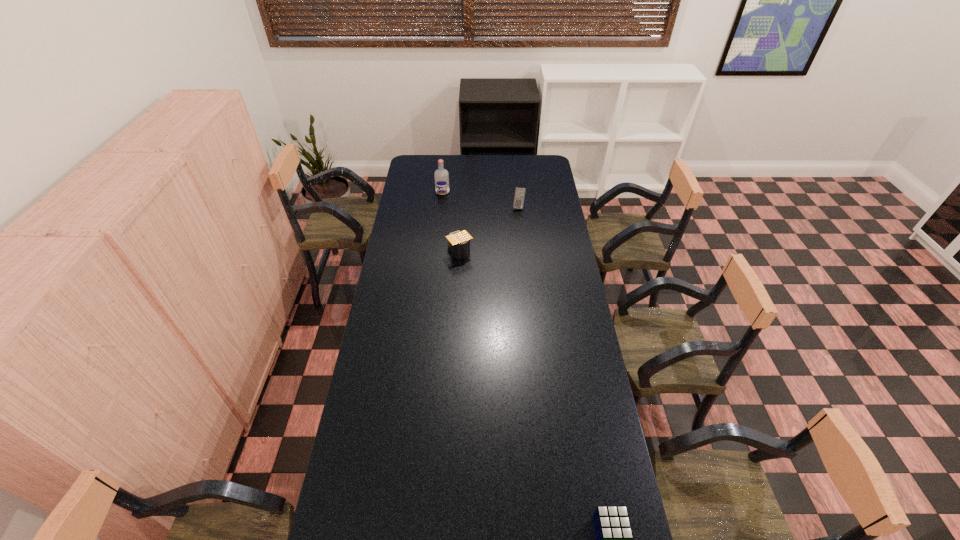
Where is `vacant space at the left edge`? Image resolution: width=960 pixels, height=540 pixels. vacant space at the left edge is located at coordinates (400, 323).

In the image, there is a desktop. At what (x,y) coordinates should I click in order to perform the action: click on vacant space at the right edge. Please return your answer as a coordinate pair (x, y). This screenshot has width=960, height=540. Looking at the image, I should click on (553, 181).

This screenshot has width=960, height=540. Identify the location of vacant space at the far left corner of the desktop. (430, 171).

Locate an element on the screen. vacant area that lies between the tallest object and the right calculator is located at coordinates (481, 199).

The width and height of the screenshot is (960, 540). In order to click on empty space between the third nearest object and the third object from right to left in this screenshot , I will do `click(490, 230)`.

Locate an element on the screen. Image resolution: width=960 pixels, height=540 pixels. unoccupied area between the nearer calculator and the tallest object is located at coordinates (451, 222).

Where is `unoccupied position between the second nearest object and the second object from right to left`? unoccupied position between the second nearest object and the second object from right to left is located at coordinates (490, 230).

Point out which object is positioned as the nearest to the second object from left to right. Please provide its 2D coordinates. Your answer should be formatted as a tuple, i.e. [(x, y)], where the tuple contains the x and y coordinates of a point satisfying the conditions above.

[(519, 195)]

You are a GUI agent. You are given a task and a screenshot of the screen. Output one action in this format:
    pyautogui.click(x=<x>, y=<y>)
    Task: Click on the object that is the second closest one to the nearest object
    The image size is (960, 540).
    Given the screenshot: What is the action you would take?
    pyautogui.click(x=519, y=195)

Point out which calculator is positioned as the nearest to the farthest object. Please provide its 2D coordinates. Your answer should be formatted as a tuple, i.e. [(x, y)], where the tuple contains the x and y coordinates of a point satisfying the conditions above.

[(519, 195)]